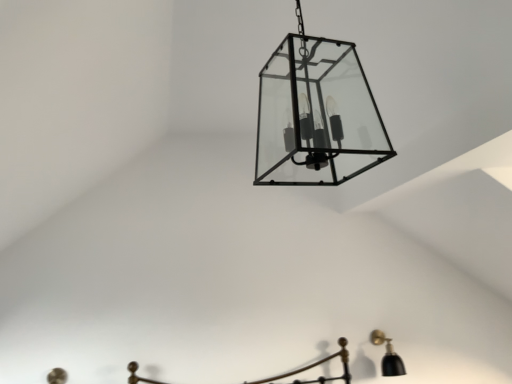
Question: Is clear glass lantern at center, the 2th lamp in the back-to-front sequence, oriented towards black matte wall sconce at lower right, the second lamp viewed from the left?

Choices:
 (A) yes
 (B) no

Answer: (B)

Question: Does clear glass lantern at center, which is counted as the 1th lamp, starting from the top, have a smaller size compared to black matte wall sconce at lower right, acting as the first lamp starting from the bottom?

Choices:
 (A) no
 (B) yes

Answer: (A)

Question: Is black matte wall sconce at lower right, the second lamp viewed from the left, completely or partially inside clear glass lantern at center, which is counted as the 1th lamp, starting from the top?

Choices:
 (A) no
 (B) yes

Answer: (A)

Question: Is clear glass lantern at center, acting as the first lamp starting from the front, to the right of black matte wall sconce at lower right, which is the first lamp in back-to-front order, from the viewer's perspective?

Choices:
 (A) yes
 (B) no

Answer: (B)

Question: Considering the relative sizes of clear glass lantern at center, which is counted as the 1th lamp, starting from the top, and black matte wall sconce at lower right, which is the first lamp in back-to-front order, in the image provided, is clear glass lantern at center, which is counted as the 1th lamp, starting from the top, bigger than black matte wall sconce at lower right, which is the first lamp in back-to-front order,?

Choices:
 (A) yes
 (B) no

Answer: (A)

Question: Is clear glass lantern at center, the 2th lamp in the back-to-front sequence, positioned behind black matte wall sconce at lower right, placed as the first lamp when sorted from right to left?

Choices:
 (A) no
 (B) yes

Answer: (A)

Question: Considering the relative positions of black matte wall sconce at lower right, the 2th lamp from the top, and clear glass lantern at center, the second lamp from the bottom, in the image provided, is black matte wall sconce at lower right, the 2th lamp from the top, to the left of clear glass lantern at center, the second lamp from the bottom, from the viewer's perspective?

Choices:
 (A) yes
 (B) no

Answer: (B)

Question: From the image's perspective, does black matte wall sconce at lower right, the 2th lamp from the top, appear lower than clear glass lantern at center, the second lamp when ordered from right to left?

Choices:
 (A) no
 (B) yes

Answer: (B)

Question: Is black matte wall sconce at lower right, placed as the first lamp when sorted from right to left, outside clear glass lantern at center, the first lamp positioned from the left?

Choices:
 (A) yes
 (B) no

Answer: (A)

Question: From a real-world perspective, is black matte wall sconce at lower right, placed as the first lamp when sorted from right to left, positioned under clear glass lantern at center, the second lamp when ordered from right to left, based on gravity?

Choices:
 (A) yes
 (B) no

Answer: (A)

Question: From a real-world perspective, is black matte wall sconce at lower right, the second lamp viewed from the left, on clear glass lantern at center, acting as the first lamp starting from the front?

Choices:
 (A) no
 (B) yes

Answer: (A)

Question: Is black matte wall sconce at lower right, which is the first lamp in back-to-front order, thinner than clear glass lantern at center, the first lamp positioned from the left?

Choices:
 (A) no
 (B) yes

Answer: (B)

Question: Is clear glass lantern at center, acting as the first lamp starting from the front, in front of or behind black matte wall sconce at lower right, the second lamp viewed from the left, in the image?

Choices:
 (A) front
 (B) behind

Answer: (A)